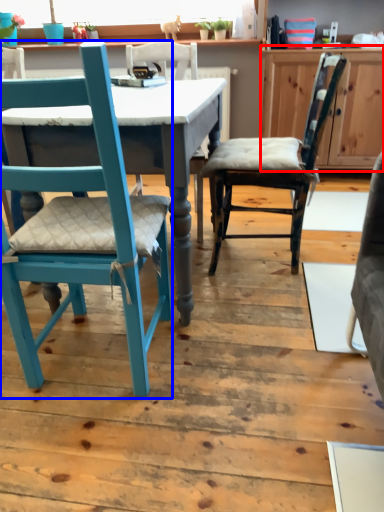
Question: Which object appears farthest to the camera in this image, cabinetry (highlighted by a red box) or chair (highlighted by a blue box)?

Choices:
 (A) cabinetry
 (B) chair

Answer: (A)